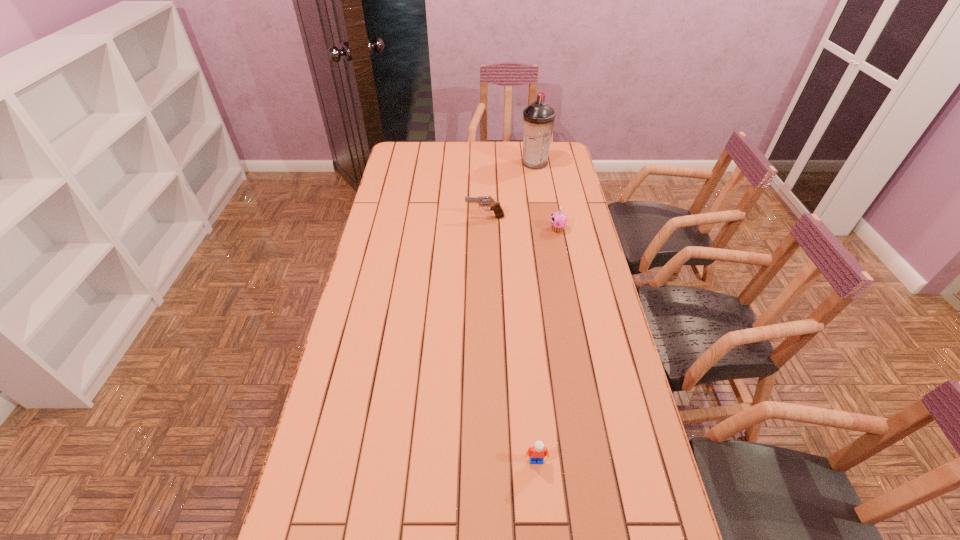
Find the location of a particular element. This screenshot has height=540, width=960. vacant space at the left edge of the desktop is located at coordinates (415, 178).

Image resolution: width=960 pixels, height=540 pixels. In the image, there is a desktop. What are the coordinates of `blank space at the right edge` in the screenshot? It's located at (556, 179).

This screenshot has height=540, width=960. I want to click on free spot at the far left corner of the desktop, so click(x=420, y=146).

Identify the location of vacant space at the far right corner of the desktop. (565, 157).

You are a GUI agent. You are given a task and a screenshot of the screen. Output one action in this format:
    pyautogui.click(x=<x>, y=<y>)
    Task: Click on the vacant area that lies between the pistol and the farthest object
    This screenshot has height=540, width=960.
    Given the screenshot: What is the action you would take?
    pyautogui.click(x=510, y=190)

Find the location of a particular element. This screenshot has height=540, width=960. free area in between the third nearest object and the nearest object is located at coordinates (511, 339).

At what (x,y) coordinates should I click in order to perform the action: click on vacant space that's between the pistol and the tallest object. Please return your answer as a coordinate pair (x, y). Looking at the image, I should click on (510, 190).

I want to click on vacant region between the cupcake and the Lego, so click(547, 345).

Image resolution: width=960 pixels, height=540 pixels. Find the location of `unoccupied area between the farthest object and the second object from left to right`. unoccupied area between the farthest object and the second object from left to right is located at coordinates (536, 312).

At what (x,y) coordinates should I click in order to perform the action: click on free space that is in between the third object from right to left and the leftmost object. Please return your answer as a coordinate pair (x, y). Looking at the image, I should click on (x=511, y=339).